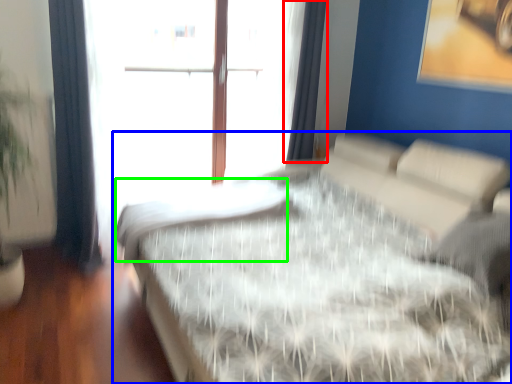
Question: Based on their relative distances, which object is farther from curtain (highlighted by a red box)? Choose from bed (highlighted by a blue box) and mattress (highlighted by a green box).

Choices:
 (A) bed
 (B) mattress

Answer: (A)